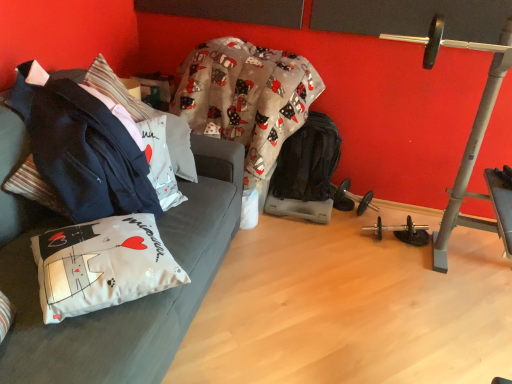
Question: Does white fabric couch at left have a lesser width compared to black rubber dumbbell at lower center?

Choices:
 (A) no
 (B) yes

Answer: (A)

Question: Is white fabric couch at left not within black rubber dumbbell at lower center?

Choices:
 (A) yes
 (B) no

Answer: (A)

Question: From the image's perspective, does white fabric couch at left appear lower than black rubber dumbbell at lower center?

Choices:
 (A) yes
 (B) no

Answer: (A)

Question: Can you confirm if white fabric couch at left is positioned to the left of black rubber dumbbell at lower center?

Choices:
 (A) no
 (B) yes

Answer: (B)

Question: Is white fabric couch at left to the right of black rubber dumbbell at lower center from the viewer's perspective?

Choices:
 (A) yes
 (B) no

Answer: (B)

Question: Is white fabric couch at left closer to the viewer compared to black rubber dumbbell at lower center?

Choices:
 (A) no
 (B) yes

Answer: (B)

Question: Considering the relative positions of white fabric pillow at lower left, the first pillow positioned from the front, and white fabric pillow at center, which is the first pillow from top to bottom, in the image provided, is white fabric pillow at lower left, the first pillow positioned from the front, behind white fabric pillow at center, which is the first pillow from top to bottom,?

Choices:
 (A) yes
 (B) no

Answer: (B)

Question: Is there a large distance between white fabric pillow at lower left, marked as the second pillow in a back-to-front arrangement, and white fabric pillow at center, which is the 2th pillow from bottom to top?

Choices:
 (A) no
 (B) yes

Answer: (A)

Question: From a real-world perspective, is white fabric pillow at lower left, the second pillow when ordered from top to bottom, positioned under white fabric pillow at center, which is the first pillow from top to bottom, based on gravity?

Choices:
 (A) yes
 (B) no

Answer: (A)

Question: From a real-world perspective, is white fabric pillow at lower left, which is counted as the 1th pillow, starting from the bottom, over white fabric pillow at center, which is the first pillow from top to bottom?

Choices:
 (A) no
 (B) yes

Answer: (A)

Question: Considering the relative sizes of white fabric pillow at lower left, marked as the second pillow in a back-to-front arrangement, and white fabric pillow at center, positioned as the first pillow in back-to-front order, in the image provided, is white fabric pillow at lower left, marked as the second pillow in a back-to-front arrangement, taller than white fabric pillow at center, positioned as the first pillow in back-to-front order,?

Choices:
 (A) no
 (B) yes

Answer: (A)

Question: Can you confirm if white fabric pillow at lower left, the first pillow positioned from the front, is positioned to the left of white fabric pillow at center, which is the 2th pillow from bottom to top?

Choices:
 (A) no
 (B) yes

Answer: (A)

Question: Can you confirm if dark blue fabric jacket at left is shorter than white fabric couch at left?

Choices:
 (A) no
 (B) yes

Answer: (B)